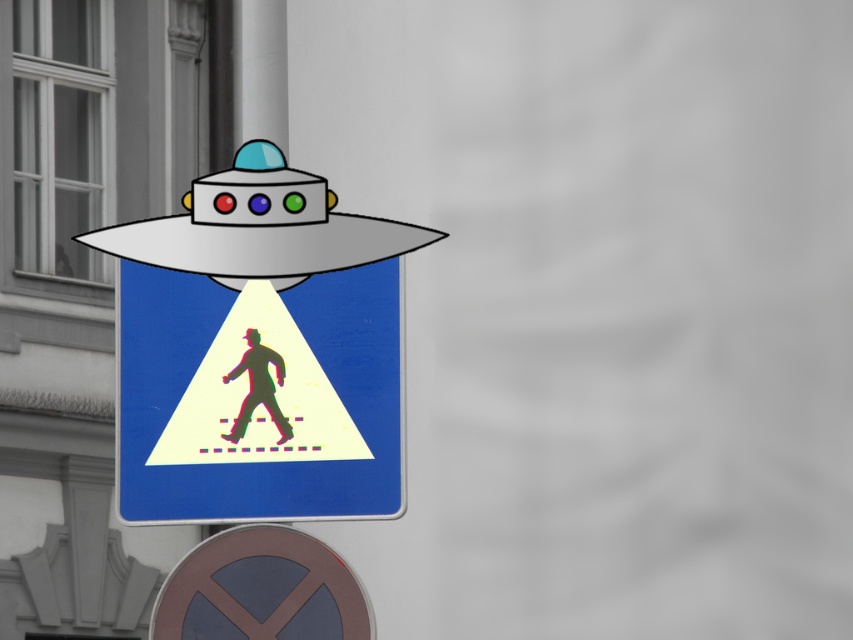
You are a city planner reviewing this surreal design. The metallic pedestrian crossing sign at center and the metallic gray circle at lower center are part of a proposed sculpture. Which object would require a taller base to stand stably on the ground?

The metallic pedestrian crossing sign at center is taller than the metallic gray circle at lower center, so it would require a taller base to stand stably on the ground.

You are an urban planner reviewing this surreal design. The city requires that all traffic signs must be visible and unobstructed from the driver perspective. Based on the image, will the metallic pedestrian crossing sign at center be obscured by the metallic gray circle at lower center?

The metallic gray circle at lower center is behind the metallic pedestrian crossing sign at center, so it will not obscure the sign from the driver perspective.

You are standing at the pedestrian crossing sign in the surreal scene. There are two points marked in the image. Which point is nearer to you, point 1 at coordinates (344,624) or point 2 at coordinates (260,362)?

Point 1 at coordinates (344,624) is closer to you than point 2 at coordinates (260,362).